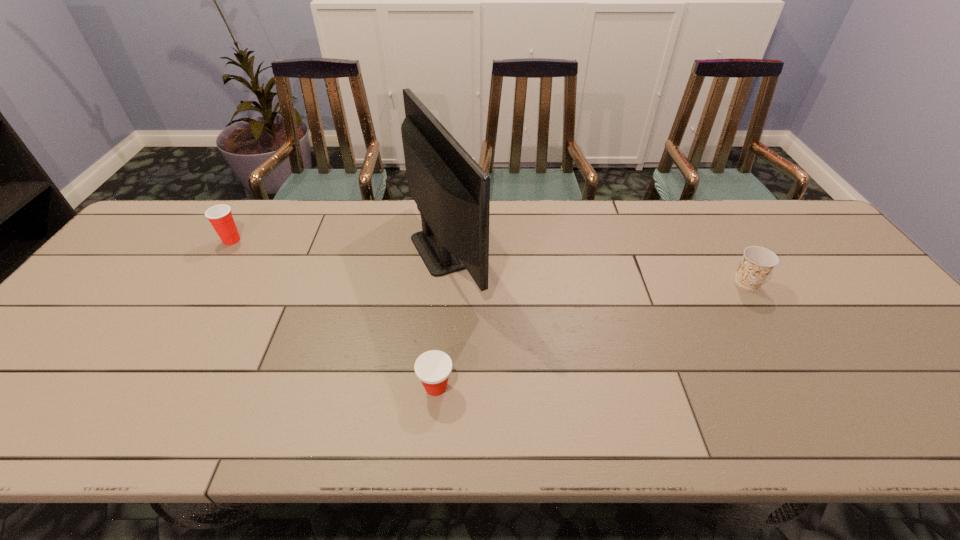
Locate an element on the screen. The image size is (960, 540). computer monitor is located at coordinates (452, 192).

Locate an element on the screen. The height and width of the screenshot is (540, 960). the leftmost Dixie cup is located at coordinates (220, 216).

At what (x,y) coordinates should I click in order to perform the action: click on the leftmost object. Please return your answer as a coordinate pair (x, y). This screenshot has width=960, height=540. Looking at the image, I should click on (220, 216).

You are a GUI agent. You are given a task and a screenshot of the screen. Output one action in this format:
    pyautogui.click(x=<x>, y=<y>)
    Task: Click on the rightmost object
    Image resolution: width=960 pixels, height=540 pixels.
    Given the screenshot: What is the action you would take?
    pyautogui.click(x=757, y=262)

At what (x,y) coordinates should I click in order to perform the action: click on the rightmost Dixie cup. Please return your answer as a coordinate pair (x, y). The height and width of the screenshot is (540, 960). Looking at the image, I should click on (757, 262).

At what (x,y) coordinates should I click in order to perform the action: click on the shortest object. Please return your answer as a coordinate pair (x, y). Looking at the image, I should click on (433, 367).

Identify the location of the nearest Dixie cup. The image size is (960, 540). (433, 367).

The image size is (960, 540). I want to click on vacant region located on the front-facing side of the computer monitor, so click(564, 249).

You are a GUI agent. You are given a task and a screenshot of the screen. Output one action in this format:
    pyautogui.click(x=<x>, y=<y>)
    Task: Click on the vacant space located 0.110m on the front of the leftmost Dixie cup
    
    Given the screenshot: What is the action you would take?
    (x=211, y=273)

Where is `vacant space situated 0.230m on the left of the rightmost Dixie cup`? The height and width of the screenshot is (540, 960). vacant space situated 0.230m on the left of the rightmost Dixie cup is located at coordinates (646, 283).